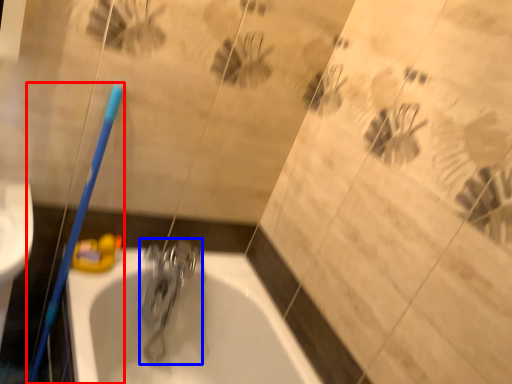
Question: Among these objects, which one is nearest to the camera, toothbrush (highlighted by a red box) or tap (highlighted by a blue box)?

Choices:
 (A) toothbrush
 (B) tap

Answer: (A)